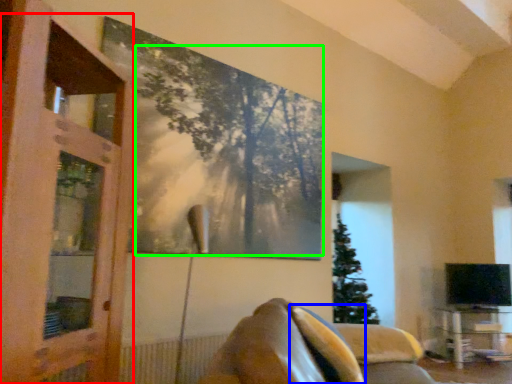
Question: Which object is the closest to the screen door (highlighted by a red box)? Choose among these: pillow (highlighted by a blue box) or tree (highlighted by a green box).

Choices:
 (A) pillow
 (B) tree

Answer: (B)